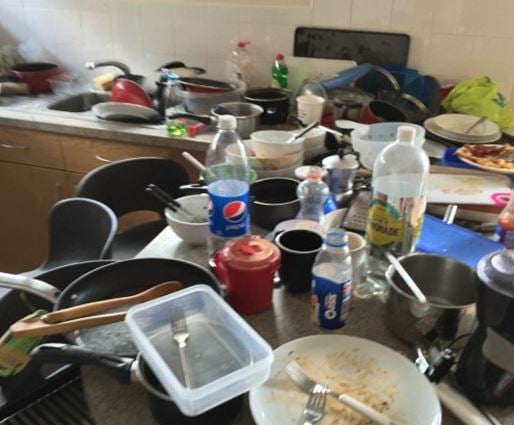
At what (x,y) coordinates should I click in order to perform the action: click on chairs. Please return your answer as a coordinate pair (x, y). The image size is (514, 425). Looking at the image, I should click on (126, 189), (76, 235).